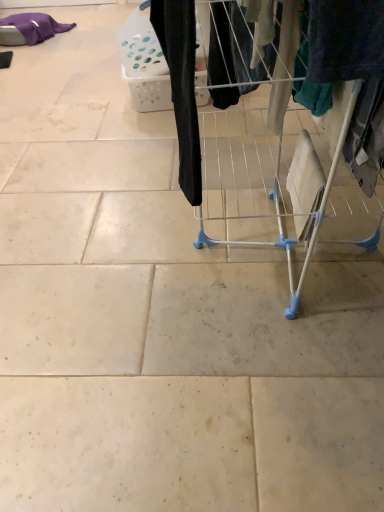
Question: Does black fabric pants at center, which is the first clothing in front-to-back order, contain purple cotton blanket at upper left, the 2th clothing from the bottom?

Choices:
 (A) no
 (B) yes

Answer: (A)

Question: Is black fabric pants at center, which is the first clothing in front-to-back order, taller than purple cotton blanket at upper left, placed as the second clothing when sorted from right to left?

Choices:
 (A) no
 (B) yes

Answer: (B)

Question: Is black fabric pants at center, which is counted as the 2th clothing, starting from the top, turned away from purple cotton blanket at upper left, which is counted as the 2th clothing, starting from the front?

Choices:
 (A) no
 (B) yes

Answer: (A)

Question: Is black fabric pants at center, which appears as the 2th clothing when viewed from the left, completely or partially outside of purple cotton blanket at upper left, which is the first clothing from back to front?

Choices:
 (A) no
 (B) yes

Answer: (B)

Question: Can you confirm if black fabric pants at center, which is counted as the 2th clothing, starting from the top, is smaller than purple cotton blanket at upper left, placed as the first clothing when sorted from left to right?

Choices:
 (A) no
 (B) yes

Answer: (B)

Question: Considering the positions of point (365, 20) and point (48, 29), is point (365, 20) closer or farther from the camera than point (48, 29)?

Choices:
 (A) closer
 (B) farther

Answer: (A)

Question: From a real-world perspective, relative to purple cotton blanket at upper left, which is counted as the 2th clothing, starting from the front, is white wire drying rack at center vertically above or below?

Choices:
 (A) below
 (B) above

Answer: (B)

Question: Is white wire drying rack at center situated inside purple cotton blanket at upper left, placed as the first clothing when sorted from left to right, or outside?

Choices:
 (A) inside
 (B) outside

Answer: (B)

Question: From the image's perspective, is white wire drying rack at center positioned above or below purple cotton blanket at upper left, which is counted as the 2th clothing, starting from the front?

Choices:
 (A) above
 (B) below

Answer: (B)

Question: In terms of height, does white wire drying rack at center look taller or shorter compared to black fabric pants at center, which is counted as the 2th clothing, starting from the top?

Choices:
 (A) tall
 (B) short

Answer: (A)

Question: Considering their positions, is white wire drying rack at center located in front of or behind black fabric pants at center, which is the first clothing in front-to-back order?

Choices:
 (A) front
 (B) behind

Answer: (A)

Question: Considering the positions of white wire drying rack at center and black fabric pants at center, which is counted as the 2th clothing, starting from the top, in the image, is white wire drying rack at center wider or thinner than black fabric pants at center, which is counted as the 2th clothing, starting from the top,?

Choices:
 (A) thin
 (B) wide

Answer: (B)

Question: From the image's perspective, relative to black fabric pants at center, which is counted as the 2th clothing, starting from the top, is white wire drying rack at center above or below?

Choices:
 (A) below
 (B) above

Answer: (A)

Question: Is black fabric pants at center, acting as the 2th clothing starting from the back, spatially inside purple cotton blanket at upper left, which is counted as the 2th clothing, starting from the front, or outside of it?

Choices:
 (A) inside
 (B) outside

Answer: (B)

Question: In terms of width, does black fabric pants at center, which appears as the 2th clothing when viewed from the left, look wider or thinner when compared to purple cotton blanket at upper left, the 2th clothing from the bottom?

Choices:
 (A) wide
 (B) thin

Answer: (B)